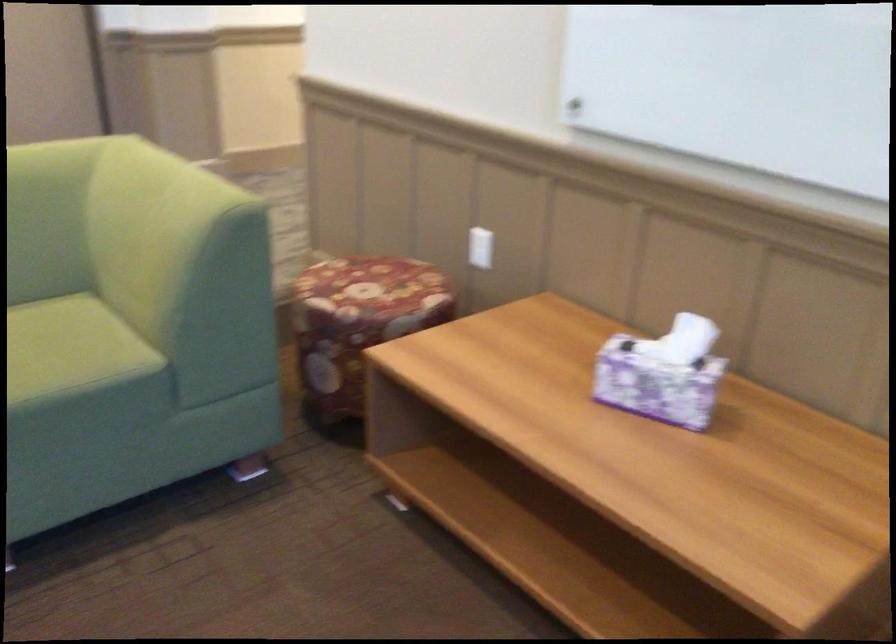
You are a GUI agent. You are given a task and a screenshot of the screen. Output one action in this format:
    pyautogui.click(x=<x>, y=<y>)
    Task: Click on the patterned footstool
    
    Given the screenshot: What is the action you would take?
    pyautogui.click(x=372, y=286)